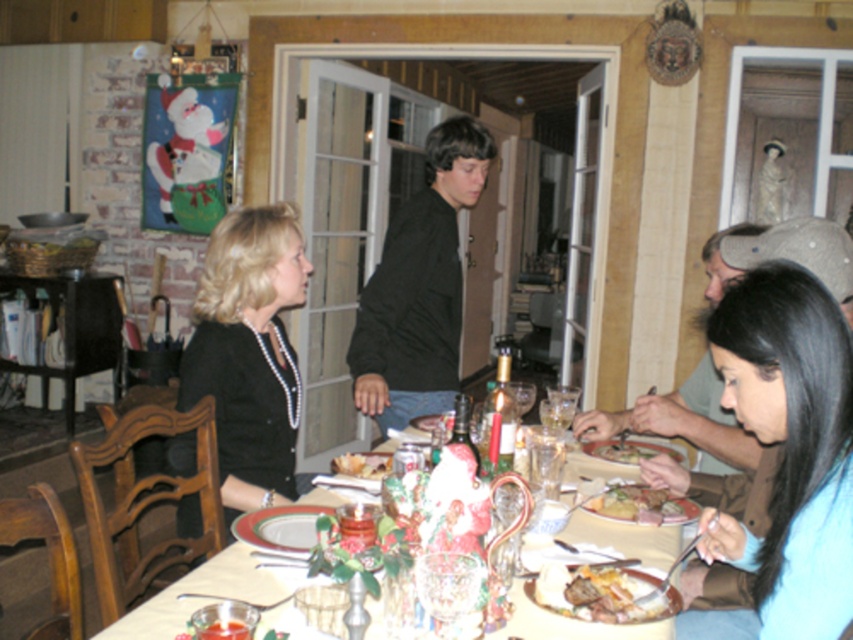
You are a photographer at a family gathering and need to capture a closeup shot of the black pearl necklace at left without moving any objects. The camera you are using has a minimum focusing distance of 6 feet. Can you take the photo from your current position?

The black pearl necklace at left and camera are 7.01 feet apart from each other. Since the minimum focusing distance is 6 feet, you can take the photo from your current position because the distance is sufficient.

Consider the image. You are a guest at this festive dinner and need to place your napkin on the table without covering the golden brown bread at center. Given the space occupied by the black silk shirt at lower right, do you think there is enough room to place your napkin next to the bread?

The black silk shirt at lower right is wider than the golden brown bread at center. Since the shirt takes up more space, there should be sufficient room to place your napkin next to the bread without covering it.